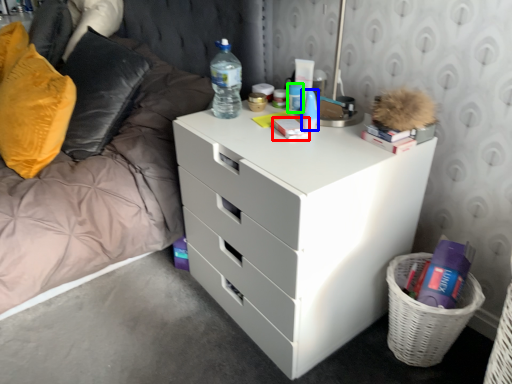
Question: Based on their relative distances, which object is nearer to book (highlighted by a red box)? Choose from toiletry (highlighted by a blue box) and toiletry (highlighted by a green box).

Choices:
 (A) toiletry
 (B) toiletry

Answer: (A)